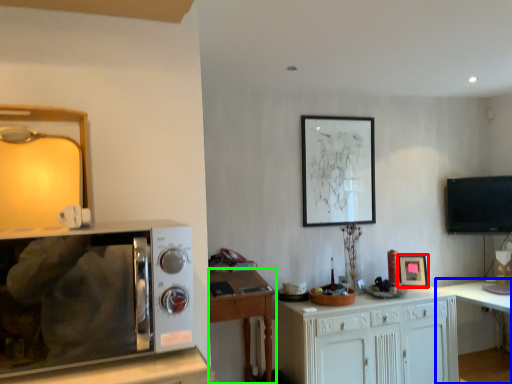
Question: Which object is positioned closest to picture frame (highlighted by a red box)? Select from table (highlighted by a blue box) and desk (highlighted by a green box).

Choices:
 (A) table
 (B) desk

Answer: (A)